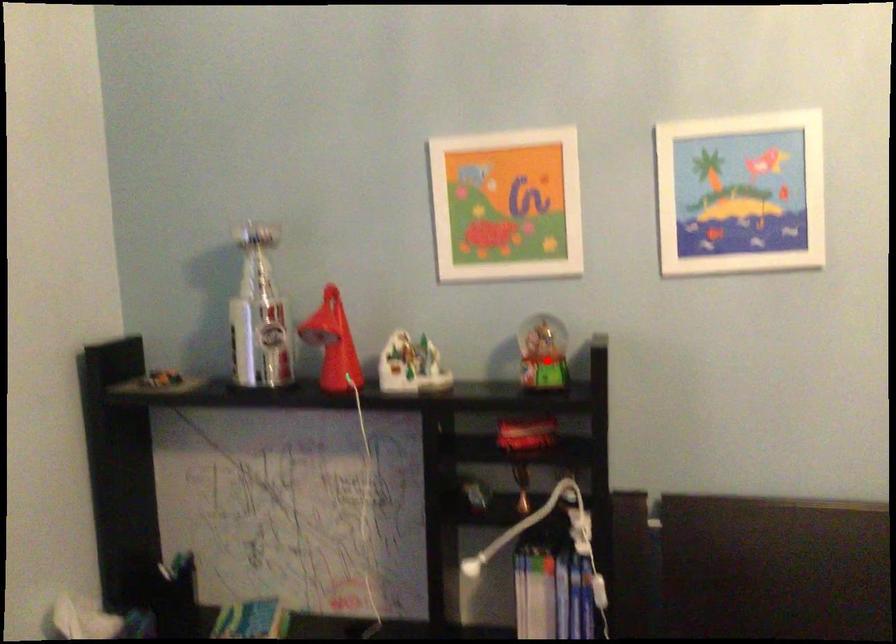
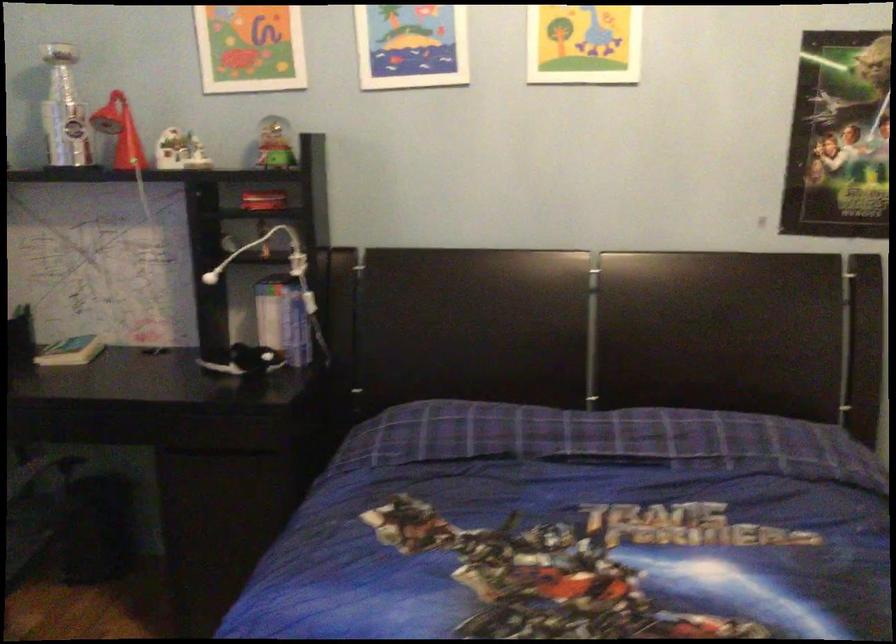
Question: I am providing you with two images of the same scene from different viewpoints. Image1 has a red point marked. In image2, the corresponding 3D location appears at what relative position? Reply with the corresponding letter.

Choices:
 (A) Closer
 (B) Farther

Answer: (B)